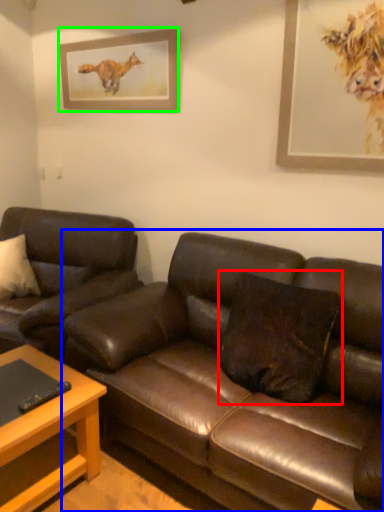
Question: Considering the real-world distances, which object is farthest from pillow (highlighted by a red box)? studio couch (highlighted by a blue box) or picture frame (highlighted by a green box)?

Choices:
 (A) studio couch
 (B) picture frame

Answer: (B)